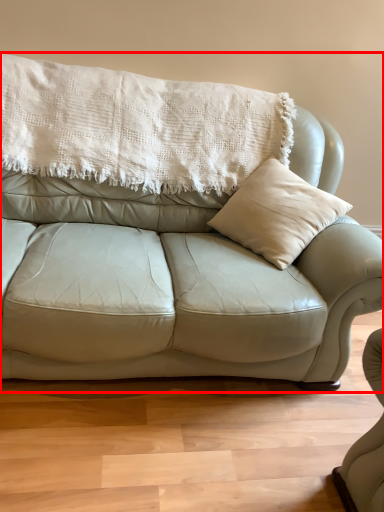
Question: From the image's perspective, what is the correct spatial positioning of studio couch (annotated by the red box) in reference to blanket?

Choices:
 (A) below
 (B) above

Answer: (A)